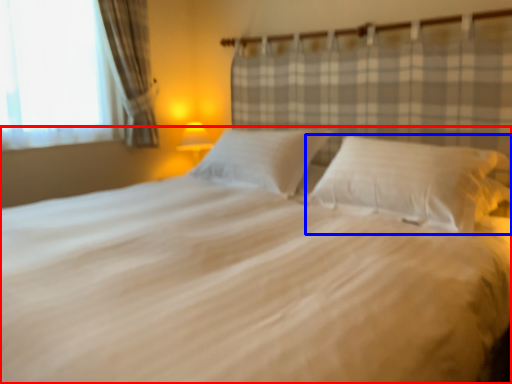
Question: Which of the following is the closest to the observer, bed (highlighted by a red box) or pillow (highlighted by a blue box)?

Choices:
 (A) bed
 (B) pillow

Answer: (A)